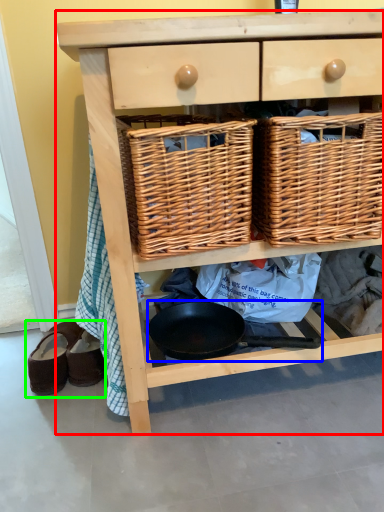
Question: Based on their relative distances, which object is farther from chest of drawers (highlighted by a red box)? Choose from frying pan (highlighted by a blue box) and footwear (highlighted by a green box).

Choices:
 (A) frying pan
 (B) footwear

Answer: (B)